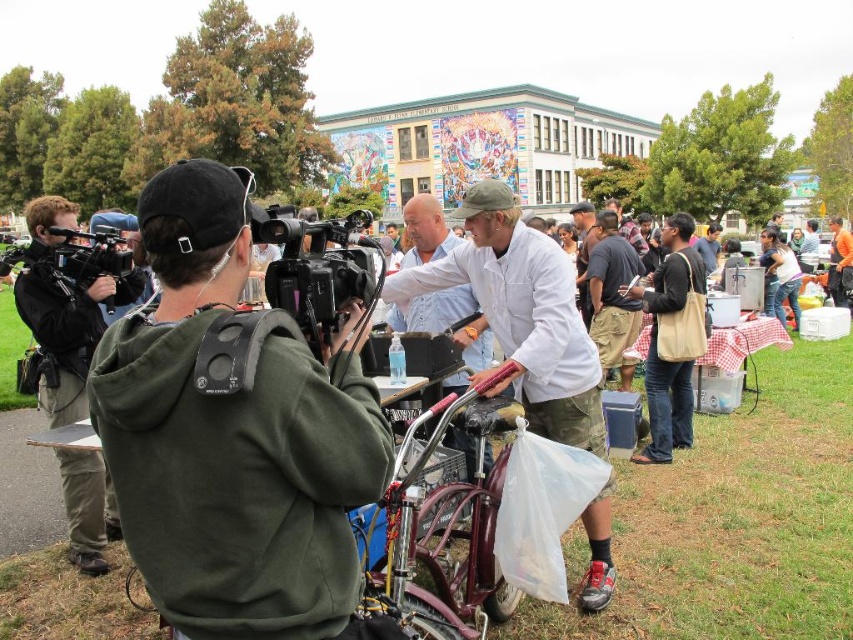
You are a photographer at the event. You need to take a photo that includes both the maroon metallic bicycle at center and the black plastic video camera at center. Which object should you position closer to the foreground to ensure both are in focus?

Since the maroon metallic bicycle at center is shorter than the black plastic video camera at center, you should position the maroon metallic bicycle at center closer to the foreground to ensure both objects are in focus.

From the picture: You are a photographer at the event and need to capture a clear photo of the maroon metallic bicycle at center without the black plastic video camera at center blocking the view. Is the bicycle currently positioned in a way that allows this?

The maroon metallic bicycle at center is positioned under the black plastic video camera at center, so the camera is directly above it. To capture a clear photo of the bicycle without the camera blocking the view, you would need to adjust your angle or move closer to avoid the obstruction.